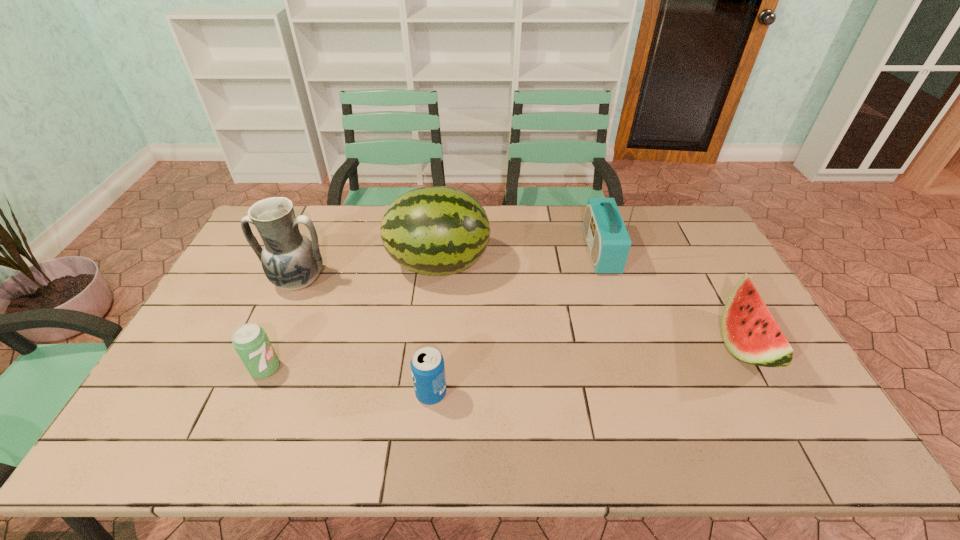
Find the location of a particular element. watermelon at the far edge is located at coordinates (436, 230).

You are a GUI agent. You are given a task and a screenshot of the screen. Output one action in this format:
    pyautogui.click(x=<x>, y=<y>)
    Task: Click on the object present at the left edge
    
    Given the screenshot: What is the action you would take?
    click(291, 261)

Locate an element on the screen. The width and height of the screenshot is (960, 540). object present at the right edge is located at coordinates (749, 331).

You are a GUI agent. You are given a task and a screenshot of the screen. Output one action in this format:
    pyautogui.click(x=<x>, y=<y>)
    Task: Click on the vacant space at the far edge of the desktop
    The height and width of the screenshot is (540, 960).
    Given the screenshot: What is the action you would take?
    pyautogui.click(x=546, y=206)

Locate an element on the screen. free space at the near edge of the desktop is located at coordinates (615, 448).

The image size is (960, 540). What are the coordinates of `free space at the left edge of the desktop` in the screenshot? It's located at (224, 300).

Identify the location of blank area at the right edge. The width and height of the screenshot is (960, 540). (712, 259).

The image size is (960, 540). Identify the location of free space at the far right corner of the desktop. (695, 239).

In the image, there is a desktop. Where is `free space at the near right corner`? This screenshot has width=960, height=540. free space at the near right corner is located at coordinates (802, 440).

This screenshot has height=540, width=960. I want to click on free space between the pitcher and the right soda, so click(x=365, y=337).